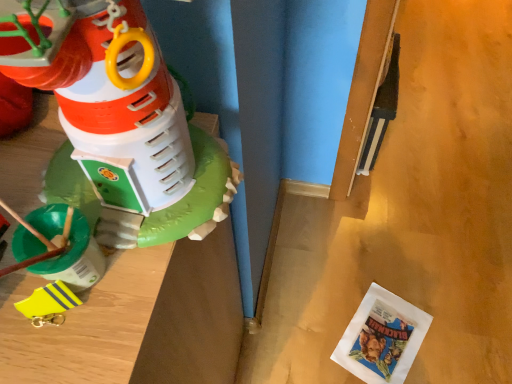
Locate an element on the screen. This screenshot has height=384, width=512. vacant space in white paper comic book at lower right (from a real-world perspective) is located at coordinates (380, 341).